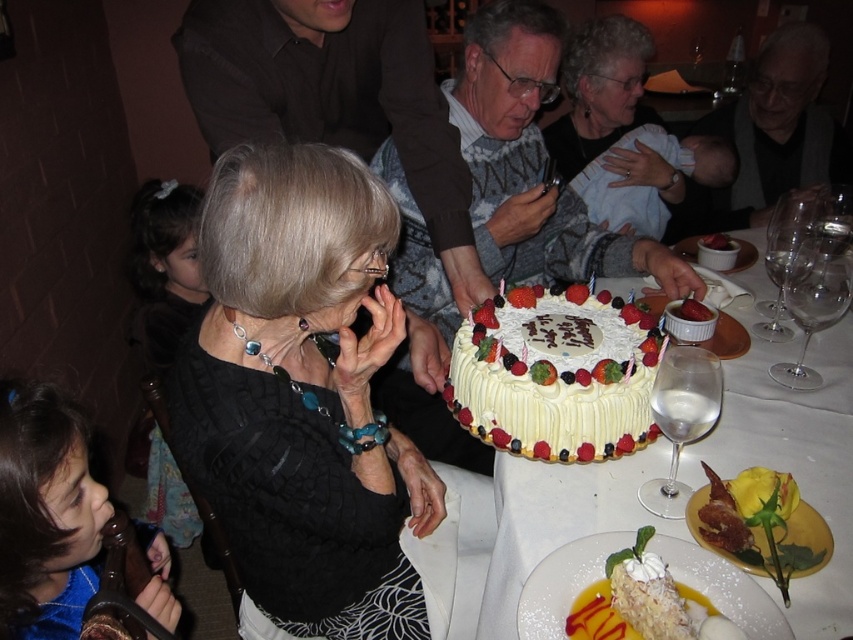
Does gray sweater at center come in front of matte black sweater at center?

That is True.

Who is shorter, gray sweater at center or matte black sweater at center?

With less height is matte black sweater at center.

The image size is (853, 640). Identify the location of gray sweater at center. (532, 161).

What do you see at coordinates (302, 394) in the screenshot?
I see `black matte sweater at center` at bounding box center [302, 394].

Does black matte sweater at center appear over gray sweater at upper right?

Incorrect, black matte sweater at center is not positioned above gray sweater at upper right.

The width and height of the screenshot is (853, 640). Identify the location of black matte sweater at center. (302, 394).

Where is `black matte sweater at center`? This screenshot has height=640, width=853. black matte sweater at center is located at coordinates (302, 394).

The image size is (853, 640). Identify the location of black matte sweater at center. (302, 394).

Based on the photo, which of these two, black matte sweater at center or blue velvet dress at center, stands shorter?

blue velvet dress at center

The height and width of the screenshot is (640, 853). Describe the element at coordinates (302, 394) in the screenshot. I see `black matte sweater at center` at that location.

Find the location of `black matte sweater at center`. black matte sweater at center is located at coordinates (302, 394).